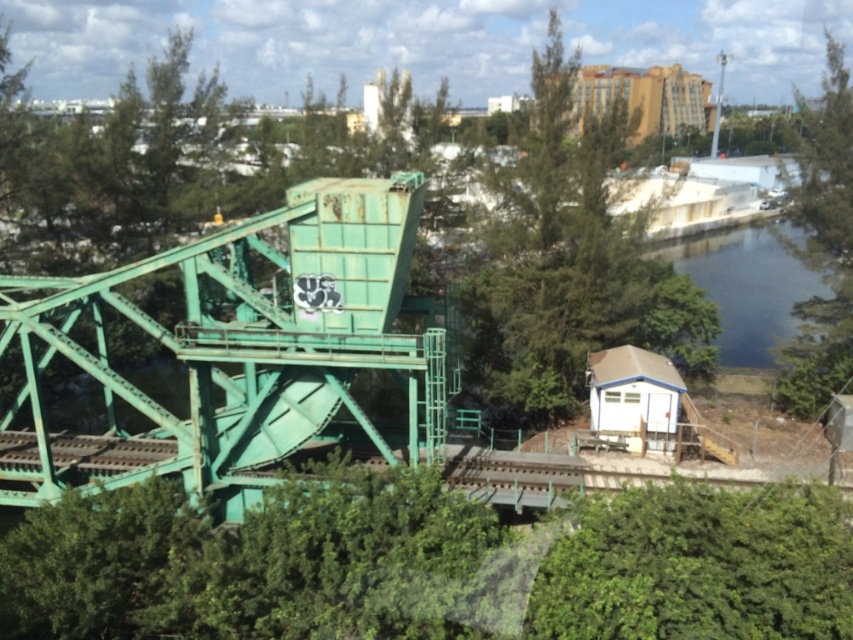
Who is taller, green leafy tree at center or dark blue water at center right?

green leafy tree at center

From the picture: Does green leafy tree at center have a larger size compared to dark blue water at center right?

Correct, green leafy tree at center is larger in size than dark blue water at center right.

The height and width of the screenshot is (640, 853). I want to click on green leafy tree at center, so click(553, 259).

The width and height of the screenshot is (853, 640). I want to click on green leafy tree at center, so click(x=553, y=259).

How much distance is there between rusty green metal bridge at center and dark blue water at center right?

A distance of 22.73 meters exists between rusty green metal bridge at center and dark blue water at center right.

In the scene shown: Does rusty green metal bridge at center appear on the right side of dark blue water at center right?

No, rusty green metal bridge at center is not to the right of dark blue water at center right.

This screenshot has width=853, height=640. I want to click on rusty green metal bridge at center, so click(x=239, y=348).

Find the location of a particular element. This screenshot has width=853, height=640. rusty green metal bridge at center is located at coordinates (239, 348).

Who is more forward, (136, 387) or (532, 323)?

Point (532, 323) is in front.

Locate an element on the screen. The height and width of the screenshot is (640, 853). rusty green metal bridge at center is located at coordinates (239, 348).